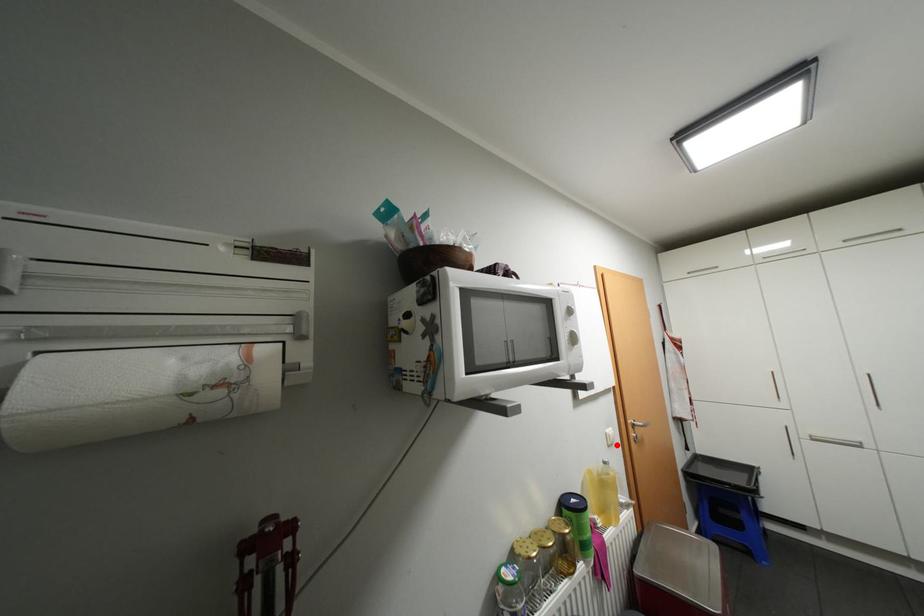
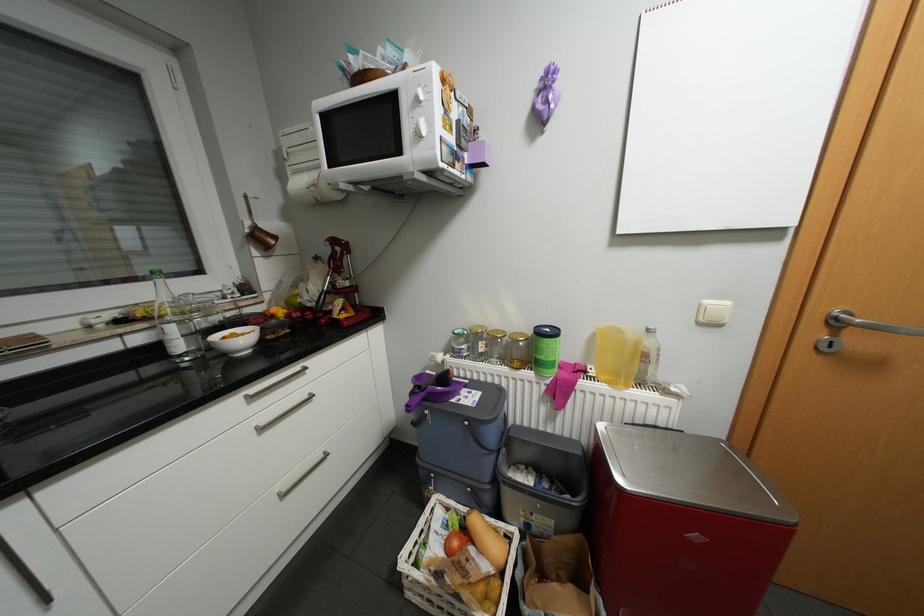
In the second image, find the point that corresponds to the highlighted location in the first image.

(708, 323)